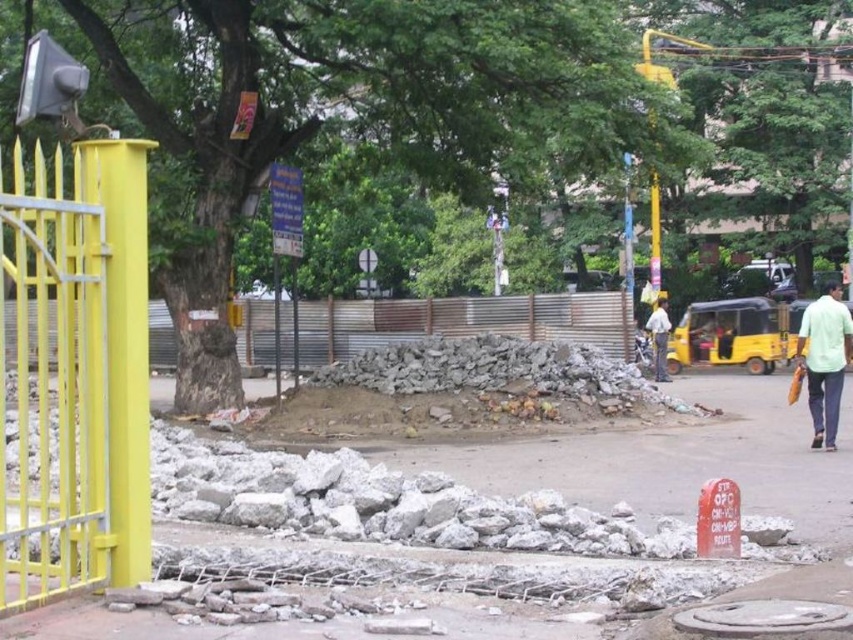
Question: From the image, what is the correct spatial relationship of corrugated metal fence at center in relation to light green shirt at right?

Choices:
 (A) above
 (B) below

Answer: (B)

Question: Which of the following is the farthest from the observer?

Choices:
 (A) (x=664, y=296)
 (B) (x=759, y=435)
 (C) (x=830, y=340)

Answer: (A)

Question: Estimate the real-world distances between objects in this image. Which object is farther from the gray concrete pavement at center?

Choices:
 (A) light blue shirt at center
 (B) corrugated metal fence at center

Answer: (A)

Question: Can you confirm if gray concrete pavement at center is wider than light blue shirt at center?

Choices:
 (A) yes
 (B) no

Answer: (A)

Question: Among these objects, which one is farthest from the camera?

Choices:
 (A) light blue shirt at center
 (B) gray concrete pavement at center

Answer: (A)

Question: Is gray concrete pavement at center wider than light green shirt at right?

Choices:
 (A) yes
 (B) no

Answer: (A)